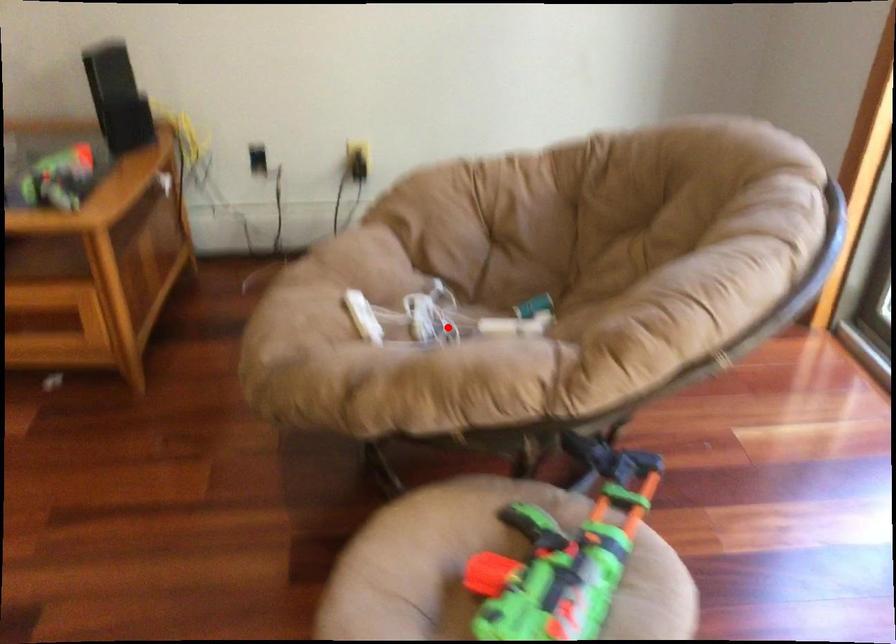
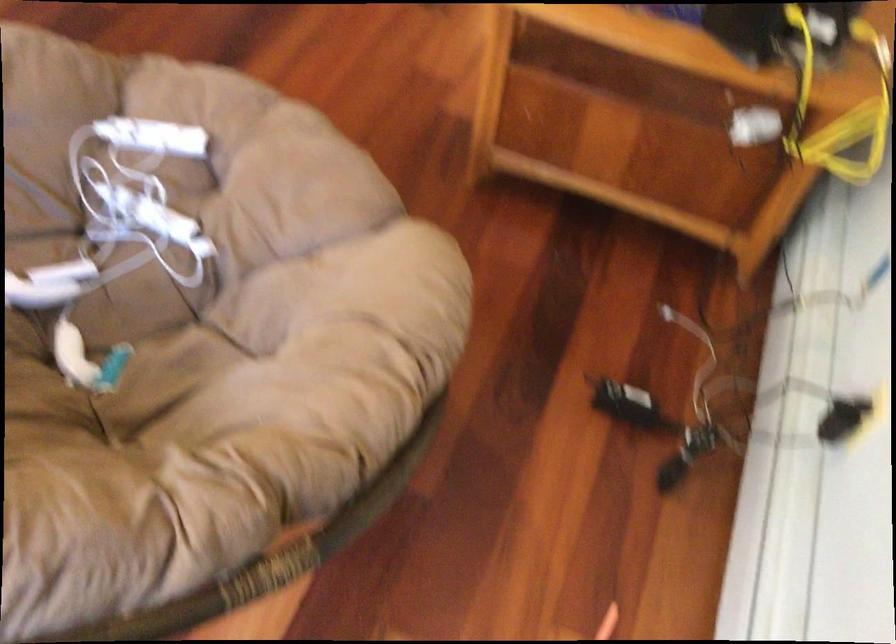
The point at the highlighted location is marked in the first image. Where is the corresponding point in the second image?

(113, 236)